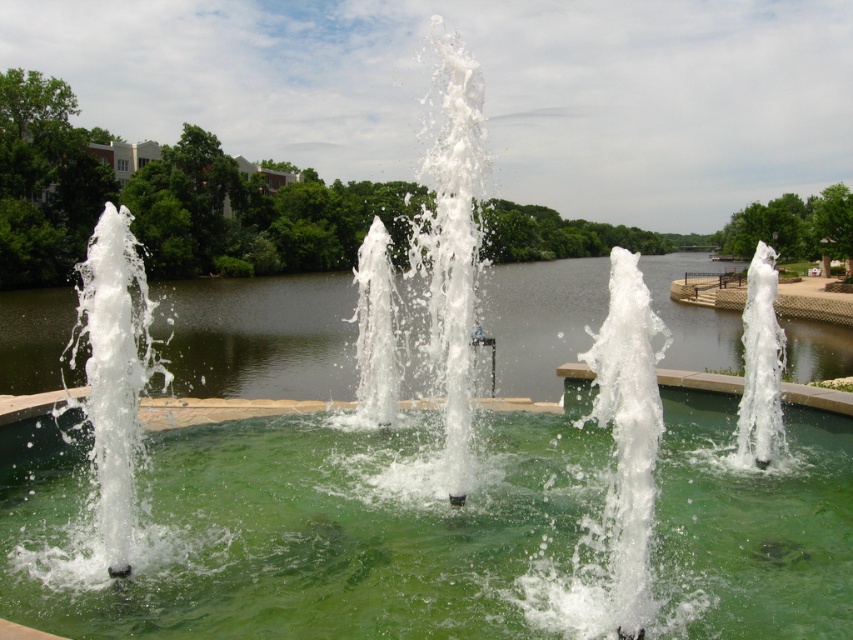
Looking at this image, you are standing at the edge of the fountain and see the green glossy water at center and the green water at center. Which one is lower in position?

The green glossy water at center is below green water at center.

You are standing at the edge of the lake in the background and want to walk to the fountain. Which direction should you go to reach the green glossy water at center?

The green glossy water at center is located at point 0.833 on the x axis and 0.373 on the y axis. Since you are at the edge of the lake in the background, you should walk towards the center of the image to reach the green glossy water at center.